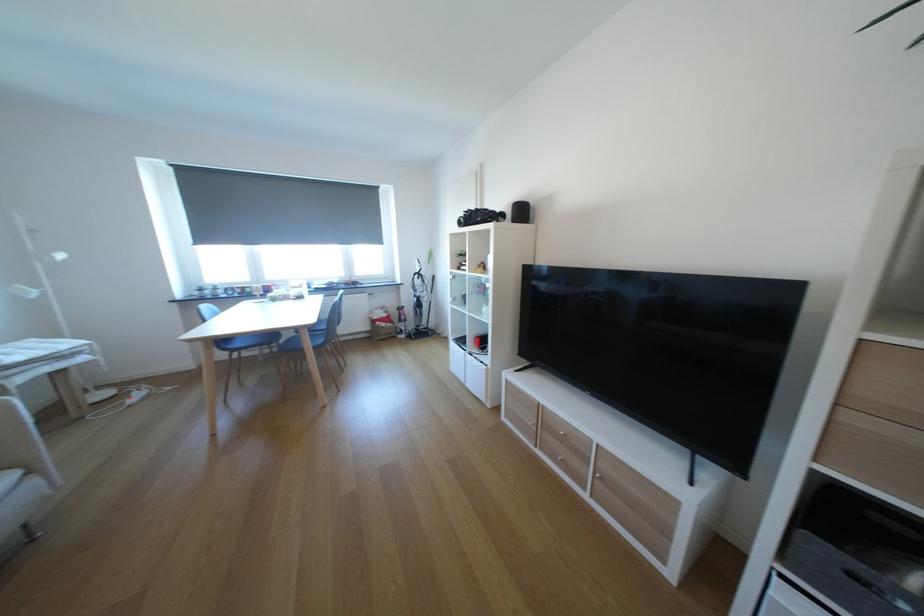
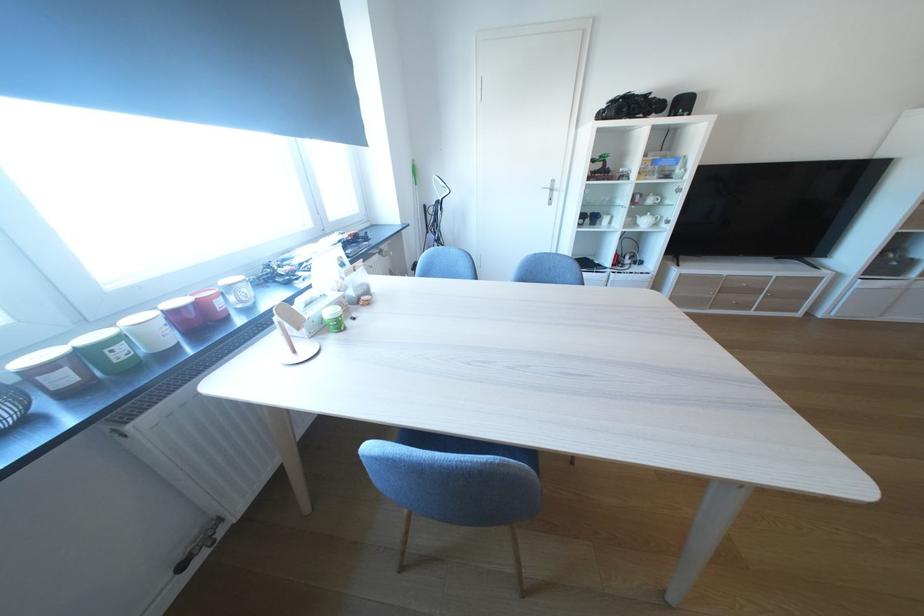
Locate, in the second image, the point that corresponds to point 249,292 in the first image.

(75, 379)